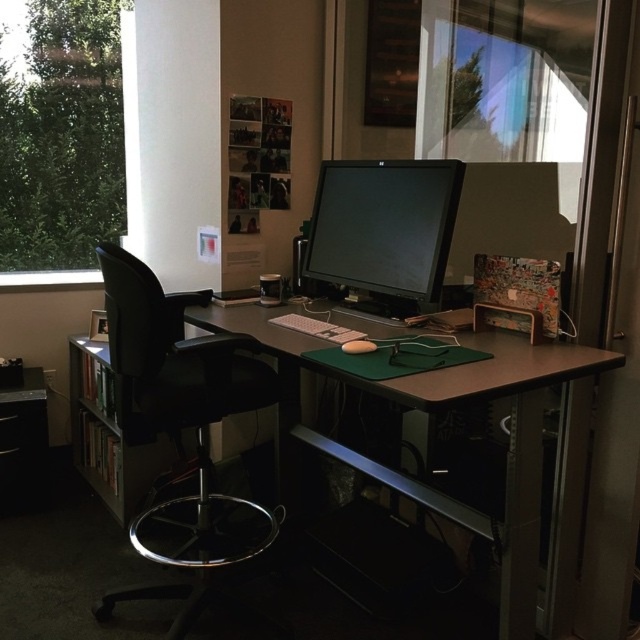
You are standing in the office and want to know where the transparent glass window at upper left is located. Can you determine its position using a coordinate system where the bottom left corner of the room is the origin point?

The transparent glass window at upper left is located at coordinates approximately 0.217 on the x axis and 0.098 on the y axis.

You are sitting in the black leather swivel chair at left and want to reach the matte black monitor at center. Can you move forward without hitting the desk?

The black leather swivel chair at left is in front of the matte black monitor at center, so moving forward would bring you closer to the monitor but since the desk is between them, you might hit the desk. However, since the chair is already positioned in front of the monitor, it might be that the desk is behind the monitor. Wait, the description says the chair is in front of the monitor, so the desk is likely behind the monitor. Therefore, moving forward from the chair towards the monitor would not hit the

You are sitting in the black leather swivel chair at left and want to look out the transparent glass window at upper left. Can you see the window directly in front of you without moving your chair?

The transparent glass window at upper left is positioned over the black leather swivel chair at left, so if you are sitting in the chair, the window is directly above you. To look at it, you would need to tilt your head upwards rather than looking straight ahead.